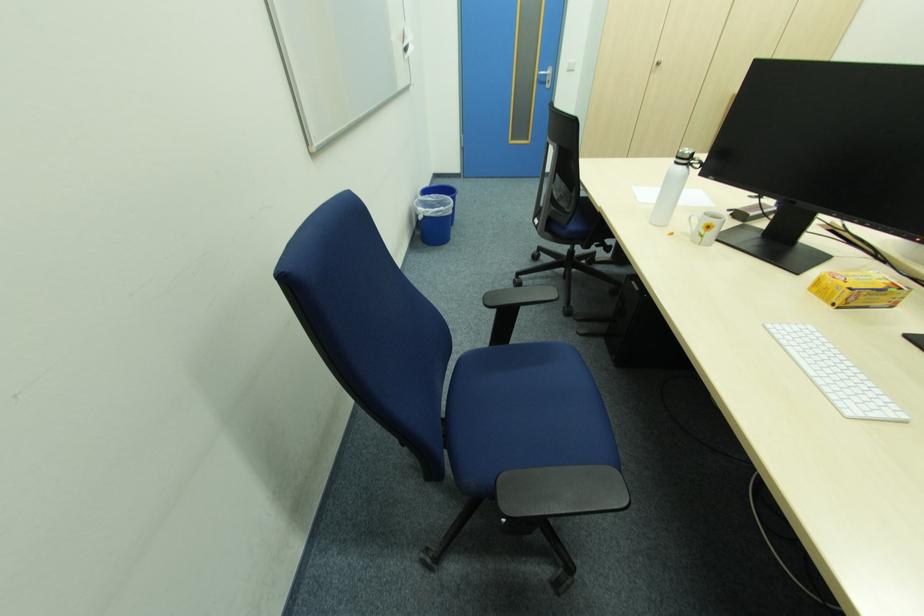
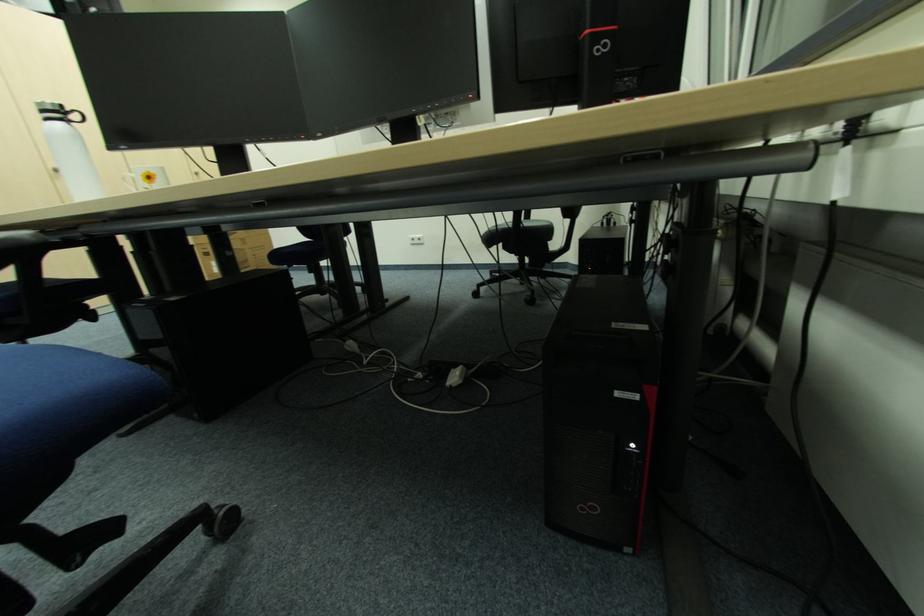
Question: The first image is from the beginning of the video and the second image is from the end. How did the camera likely rotate when shooting the video?

Choices:
 (A) Left
 (B) Right
 (C) Up
 (D) Down

Answer: (B)